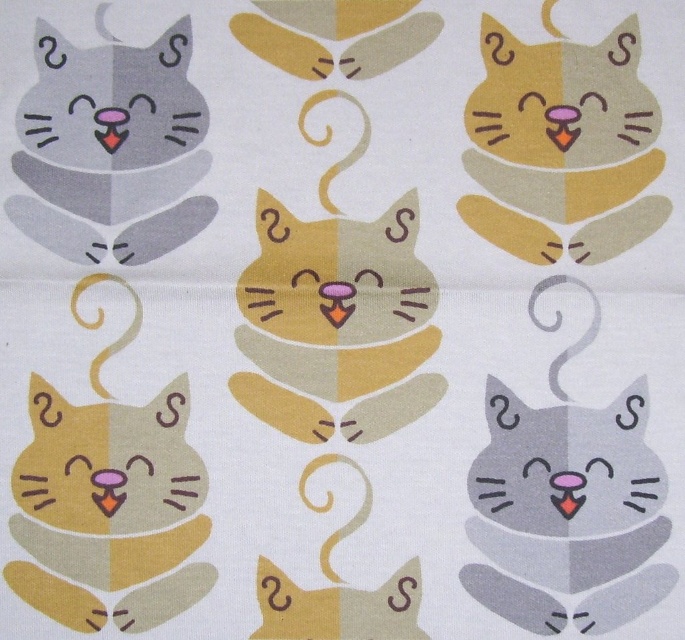
You are an artist trying to draw the scene shown in the image. You want to place a new element between the two points, point (390, 333) and point (493, 157). Based on their positions, which point should the new element be closer to?

The new element should be placed closer to point (493, 157) because point (390, 333) is in front of it, meaning it is closer to the viewer. To place the new element between them, it needs to be positioned behind point (390, 333) but in front of point (493, 157).

You are looking at the image of the cats. There are two points marked in the image. Which point is closer to you, point (595,596) or point (601,188)?

Point (595,596) is in front of point (601,188), so it is closer to you.